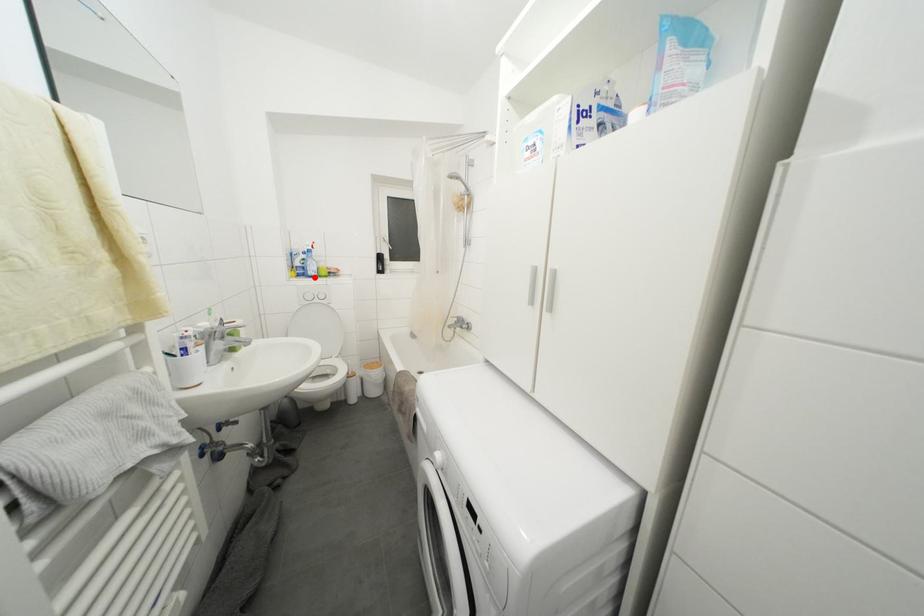
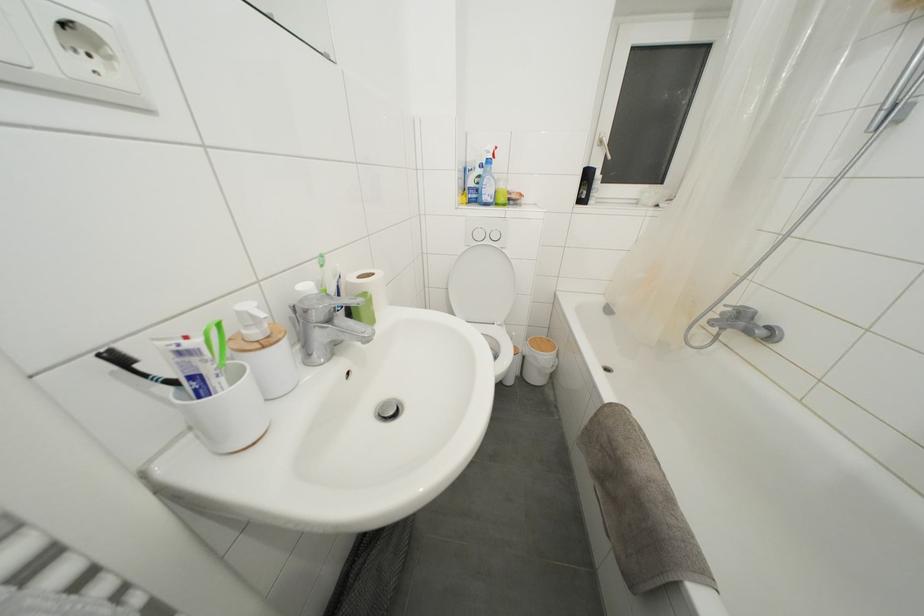
The point at the highlighted location is marked in the first image. Where is the corresponding point in the second image?

(490, 203)